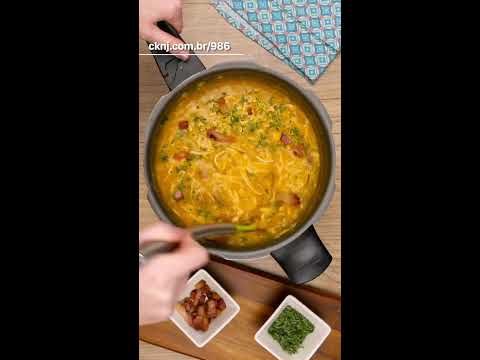
Where is `black pot handle`? The height and width of the screenshot is (360, 480). black pot handle is located at coordinates (181, 72), (181, 213).